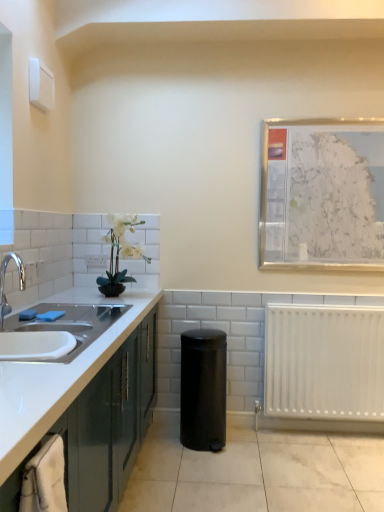
Identify the location of vacant space to the right of black matte trash can at center. The width and height of the screenshot is (384, 512). (256, 444).